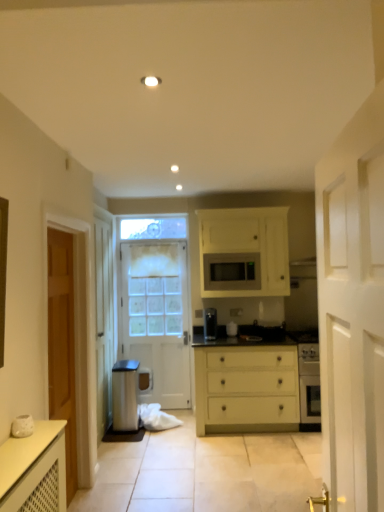
What do you see at coordinates (232, 271) in the screenshot? This screenshot has width=384, height=512. I see `matte black microwave at center` at bounding box center [232, 271].

Find the location of `matte black microwave at center`. matte black microwave at center is located at coordinates (232, 271).

Describe the element at coordinates (246, 385) in the screenshot. I see `matte yellow chest of drawers at center` at that location.

What is the approximate height of white matte microwave at center, which is the third door in left-to-right order?

white matte microwave at center, which is the third door in left-to-right order, is 38.42 inches in height.

At what (x,y) coordinates should I click in order to perform the action: click on matte black microwave at center. Please return your answer as a coordinate pair (x, y). Looking at the image, I should click on (232, 271).

Are matte yellow chest of drawers at center and white wooden door at right, the second door viewed from the left, making contact?

matte yellow chest of drawers at center and white wooden door at right, the second door viewed from the left, are not in contact.

Looking at their sizes, would you say matte yellow chest of drawers at center is wider or thinner than white wooden door at right, the 2th door viewed from the right?

matte yellow chest of drawers at center is wider than white wooden door at right, the 2th door viewed from the right.

Considering the points (252, 399) and (343, 473), which point is behind, point (252, 399) or point (343, 473)?

The point (252, 399) is more distant.

Would you say white wooden door at right, placed as the 3th door when sorted from back to front, is to the left or to the right of matte yellow chest of drawers at center in the picture?

white wooden door at right, placed as the 3th door when sorted from back to front, is to the left of matte yellow chest of drawers at center.

Considering the sizes of white wooden door at right, the second door viewed from the left, and matte yellow chest of drawers at center in the image, is white wooden door at right, the second door viewed from the left, taller or shorter than matte yellow chest of drawers at center?

Clearly, white wooden door at right, the second door viewed from the left, is taller compared to matte yellow chest of drawers at center.

From a real-world perspective, between white wooden door at right, which appears as the first door when viewed from the front, and matte yellow chest of drawers at center, who is vertically higher?

From a 3D spatial view, white wooden door at right, which appears as the first door when viewed from the front, is above.

Is white wooden door at right, which appears as the first door when viewed from the front, bigger than matte yellow chest of drawers at center?

No.

Looking at their sizes, would you say white matte microwave at center, which appears as the first door when viewed from the right, is wider or thinner than white painted wood door at center, the third door from the front?

Clearly, white matte microwave at center, which appears as the first door when viewed from the right, has more width compared to white painted wood door at center, the third door from the front.

Can you confirm if white matte microwave at center, the second door from the back, is smaller than white painted wood door at center, positioned as the third door in right-to-left order?

No.

Considering the relative positions of white matte microwave at center, which appears as the first door when viewed from the right, and white painted wood door at center, the third door from the front, in the image provided, is white matte microwave at center, which appears as the first door when viewed from the right, behind white painted wood door at center, the third door from the front,?

No.

From the image's perspective, is white matte microwave at center, which is the third door in left-to-right order, on top of white painted wood door at center, which appears as the first door when viewed from the back?

Indeed, from the image's perspective, white matte microwave at center, which is the third door in left-to-right order, is shown above white painted wood door at center, which appears as the first door when viewed from the back.

From the image's perspective, relative to white painted wood door at center, positioned as the third door in right-to-left order, is matte yellow chest of drawers at center above or below?

matte yellow chest of drawers at center is below white painted wood door at center, positioned as the third door in right-to-left order.

Considering the relative positions of matte yellow chest of drawers at center and white painted wood door at center, positioned as the third door in right-to-left order, in the image provided, is matte yellow chest of drawers at center to the left of white painted wood door at center, positioned as the third door in right-to-left order, from the viewer's perspective?

Incorrect, matte yellow chest of drawers at center is not on the left side of white painted wood door at center, positioned as the third door in right-to-left order.

Can we say matte yellow chest of drawers at center lies outside white painted wood door at center, positioned as the third door in right-to-left order?

Indeed, matte yellow chest of drawers at center is completely outside white painted wood door at center, positioned as the third door in right-to-left order.

Which of these two, matte yellow chest of drawers at center or white painted wood door at center, which appears as the 1th door when viewed from the left, stands taller?

white painted wood door at center, which appears as the 1th door when viewed from the left, is taller.

Between white matte microwave at center, the second door from the back, and white wooden door at right, placed as the 3th door when sorted from back to front, which one has less height?

Standing shorter between the two is white matte microwave at center, the second door from the back.

Where is `the 1st door located beneath the white matte microwave at center, the second door from the back (from a real-world perspective)`? This screenshot has height=512, width=384. the 1st door located beneath the white matte microwave at center, the second door from the back (from a real-world perspective) is located at coordinates (x=352, y=308).

From the image's perspective, is white matte microwave at center, which is the second door in front-to-back order, positioned above or below white wooden door at right, the 2th door viewed from the right?

white matte microwave at center, which is the second door in front-to-back order, is above white wooden door at right, the 2th door viewed from the right.

Between point (230, 292) and point (359, 303), which one is positioned in front?

The point (359, 303) is in front.

Could white matte microwave at center, which is the second door in front-to-back order, be considered to be inside white wooden door at right, placed as the 3th door when sorted from back to front?

No, white matte microwave at center, which is the second door in front-to-back order, is located outside of white wooden door at right, placed as the 3th door when sorted from back to front.

Considering the positions of objects white wooden door at right, which appears as the first door when viewed from the front, and white matte microwave at center, which appears as the first door when viewed from the right, in the image provided, who is more to the left, white wooden door at right, which appears as the first door when viewed from the front, or white matte microwave at center, which appears as the first door when viewed from the right,?

white wooden door at right, which appears as the first door when viewed from the front.

How far apart are white wooden door at right, which appears as the first door when viewed from the front, and white matte microwave at center, which is the third door in left-to-right order?

The distance of white wooden door at right, which appears as the first door when viewed from the front, from white matte microwave at center, which is the third door in left-to-right order, is 3.38 meters.

Locate an element on the screen. This screenshot has width=384, height=512. door on the right of white wooden door at right, which appears as the first door when viewed from the front is located at coordinates (244, 252).

Can you tell me how much white wooden door at right, the 2th door viewed from the right, and white painted wood door at center, which appears as the first door when viewed from the back, differ in facing direction?

There is a 93.8-degree angle between the facing directions of white wooden door at right, the 2th door viewed from the right, and white painted wood door at center, which appears as the first door when viewed from the back.

Can you confirm if white wooden door at right, placed as the 3th door when sorted from back to front, is wider than white painted wood door at center, positioned as the third door in right-to-left order?

Incorrect, the width of white wooden door at right, placed as the 3th door when sorted from back to front, does not surpass that of white painted wood door at center, positioned as the third door in right-to-left order.

Is white wooden door at right, which appears as the first door when viewed from the front, to the left or to the right of white painted wood door at center, positioned as the third door in right-to-left order, in the image?

Clearly, white wooden door at right, which appears as the first door when viewed from the front, is on the right of white painted wood door at center, positioned as the third door in right-to-left order, in the image.

Considering the positions of point (375, 318) and point (140, 361), is point (375, 318) closer or farther from the camera than point (140, 361)?

Point (375, 318).

From the matte yellow chest of drawers at center, count the 1st door to the left and point to it. Please provide its 2D coordinates.

[(352, 308)]

The height and width of the screenshot is (512, 384). Identify the location of door in front of the matte yellow chest of drawers at center. (352, 308).

Considering their positions, is matte black microwave at center positioned closer to matte yellow chest of drawers at center than white matte microwave at center, which is the third door in left-to-right order?

Based on the image, white matte microwave at center, which is the third door in left-to-right order, appears to be nearer to matte yellow chest of drawers at center.

When comparing their distances from matte black microwave at center, does white matte microwave at center, the second door from the back, or white painted wood door at center, the third door from the front, seem further?

white painted wood door at center, the third door from the front, lies further to matte black microwave at center than the other object.

Based on their spatial positions, is matte black microwave at center or white wooden door at right, the second door viewed from the left, closer to white matte microwave at center, which appears as the first door when viewed from the right?

matte black microwave at center lies closer to white matte microwave at center, which appears as the first door when viewed from the right, than the other object.

When comparing their distances from white painted wood door at center, which appears as the 1th door when viewed from the left, does matte black microwave at center or white matte microwave at center, the second door from the back, seem closer?

Based on the image, white matte microwave at center, the second door from the back, appears to be nearer to white painted wood door at center, which appears as the 1th door when viewed from the left.

Based on their spatial positions, is white matte microwave at center, which is the second door in front-to-back order, or matte yellow chest of drawers at center closer to white painted wood door at center, positioned as the third door in right-to-left order?

Based on the image, matte yellow chest of drawers at center appears to be nearer to white painted wood door at center, positioned as the third door in right-to-left order.

Which object lies further to the anchor point matte black microwave at center, white painted wood door at center, which appears as the 1th door when viewed from the left, or white matte microwave at center, the second door from the back?

white painted wood door at center, which appears as the 1th door when viewed from the left, is positioned further to the anchor matte black microwave at center.

Based on their spatial positions, is white wooden door at right, which appears as the first door when viewed from the front, or matte yellow chest of drawers at center further from white painted wood door at center, the third door from the front?

white wooden door at right, which appears as the first door when viewed from the front.

Estimate the real-world distances between objects in this image. Which object is further from white painted wood door at center, which appears as the 1th door when viewed from the left, matte black microwave at center or white wooden door at right, placed as the 3th door when sorted from back to front?

The object further to white painted wood door at center, which appears as the 1th door when viewed from the left, is white wooden door at right, placed as the 3th door when sorted from back to front.

Find the location of `the chest of drawers located between white wooden door at right, which appears as the first door when viewed from the front, and white matte microwave at center, which is the second door in front-to-back order, in the depth direction`. the chest of drawers located between white wooden door at right, which appears as the first door when viewed from the front, and white matte microwave at center, which is the second door in front-to-back order, in the depth direction is located at coordinates (246, 385).

Identify the location of microwave oven that lies between white matte microwave at center, which is the third door in left-to-right order, and matte yellow chest of drawers at center from top to bottom. This screenshot has width=384, height=512. (232, 271).

At what (x,y) coordinates should I click in order to perform the action: click on door between white wooden door at right, the second door viewed from the left, and matte black microwave at center in the front-back direction. Please return your answer as a coordinate pair (x, y). The height and width of the screenshot is (512, 384). Looking at the image, I should click on (244, 252).

Image resolution: width=384 pixels, height=512 pixels. In order to click on chest of drawers between white wooden door at right, the 2th door viewed from the right, and white painted wood door at center, which appears as the 1th door when viewed from the left, from front to back in this screenshot , I will do `click(246, 385)`.